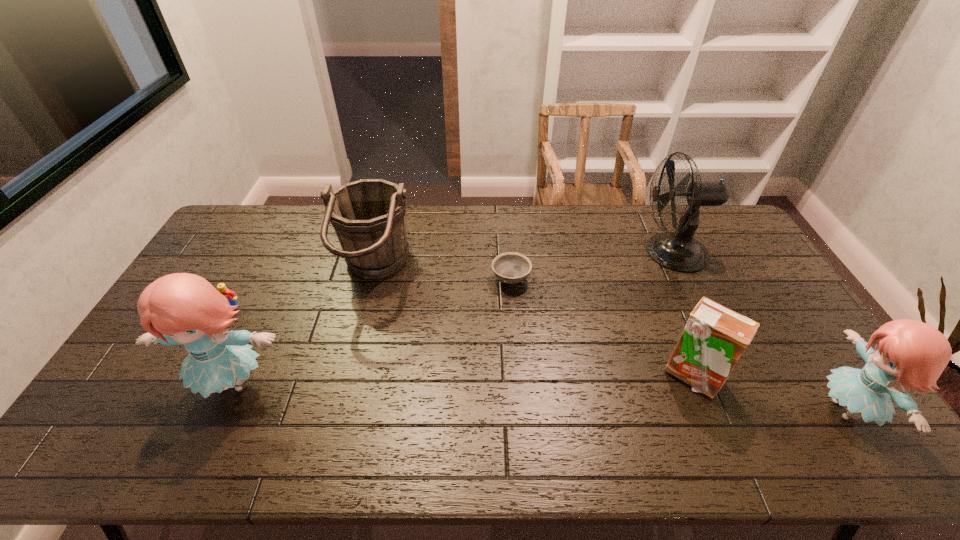
The image size is (960, 540). I want to click on free space located on the front-facing side of the rightmost object, so click(677, 410).

Find the location of `free region located 0.310m on the front-facing side of the rightmost object`. free region located 0.310m on the front-facing side of the rightmost object is located at coordinates (692, 410).

Locate an element on the screen. vacant space situated 0.120m on the front-facing side of the fan is located at coordinates (603, 252).

In order to click on vacant region located on the front-facing side of the fan in this screenshot , I will do `click(591, 252)`.

You are a GUI agent. You are given a task and a screenshot of the screen. Output one action in this format:
    pyautogui.click(x=<x>, y=<y>)
    Task: Click on the vacant area situated 0.210m on the front-facing side of the fan
    The height and width of the screenshot is (540, 960).
    Given the screenshot: What is the action you would take?
    pyautogui.click(x=577, y=252)

Find the location of `blank space located on the front of the fourth object from left to right`. blank space located on the front of the fourth object from left to right is located at coordinates (519, 393).

Where is `vacant space situated on the handle side of the fifth object from right to left`? This screenshot has width=960, height=540. vacant space situated on the handle side of the fifth object from right to left is located at coordinates (520, 271).

Locate an element on the screen. Image resolution: width=960 pixels, height=540 pixels. free space located on the face of the Lego is located at coordinates (215, 338).

Locate an element on the screen. Image resolution: width=960 pixels, height=540 pixels. fan that is at the far edge is located at coordinates (678, 251).

I want to click on bucket located at the far edge, so click(x=369, y=216).